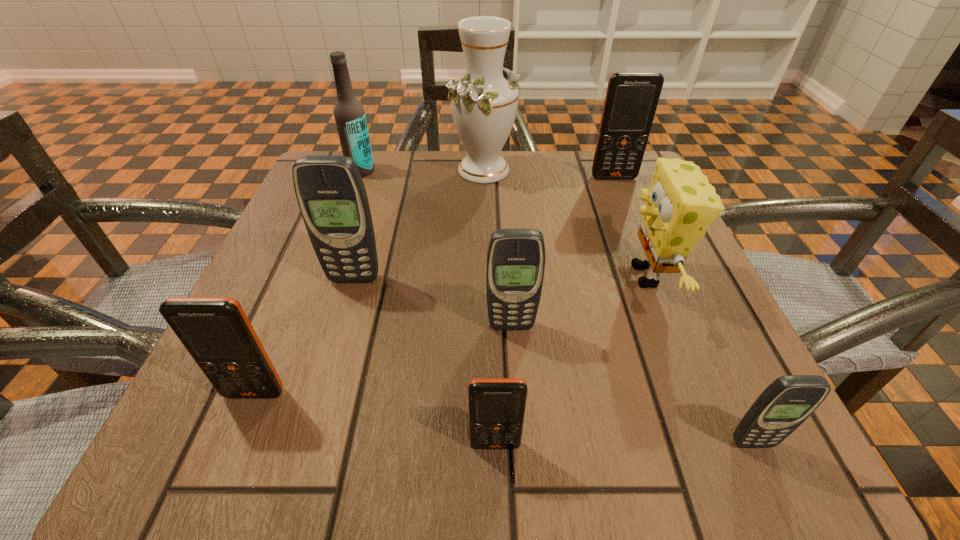
In order to click on the second nearest orange cellular telephone in this screenshot , I will do `click(217, 333)`.

Identify the location of the nearest orange cellular telephone. This screenshot has width=960, height=540. (497, 406).

Where is `the smallest orange cellular telephone`? This screenshot has width=960, height=540. the smallest orange cellular telephone is located at coordinates (497, 406).

Where is `the smallest gray cellular telephone`? Image resolution: width=960 pixels, height=540 pixels. the smallest gray cellular telephone is located at coordinates (787, 402).

You are a GUI agent. You are given a task and a screenshot of the screen. Output one action in this format:
    pyautogui.click(x=<x>, y=<y>)
    Task: Click on the nearest gray cellular telephone
    This screenshot has width=960, height=540.
    Given the screenshot: What is the action you would take?
    pyautogui.click(x=787, y=402)

Where is `vacant position located on the front of the tallest object`? vacant position located on the front of the tallest object is located at coordinates coord(485,226).

The image size is (960, 540). What are the coordinates of `vacant region located 0.200m on the label of the beer bottle` in the screenshot? It's located at (337, 235).

Find the location of `free space located on the screen of the rightmost orange cellular telephone`. free space located on the screen of the rightmost orange cellular telephone is located at coordinates (621, 196).

I want to click on vacant position located 0.260m on the screen of the leftmost gray cellular telephone, so click(x=309, y=432).

The width and height of the screenshot is (960, 540). I want to click on free region located on the face of the yellow sponge, so click(424, 276).